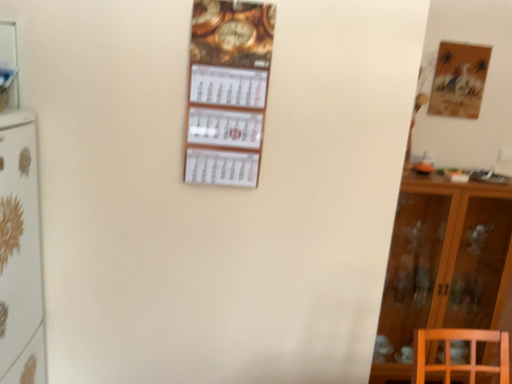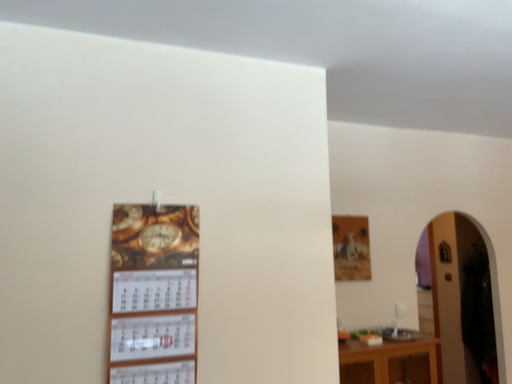
Question: How did the camera likely rotate when shooting the video?

Choices:
 (A) rotated downward
 (B) rotated upward

Answer: (B)